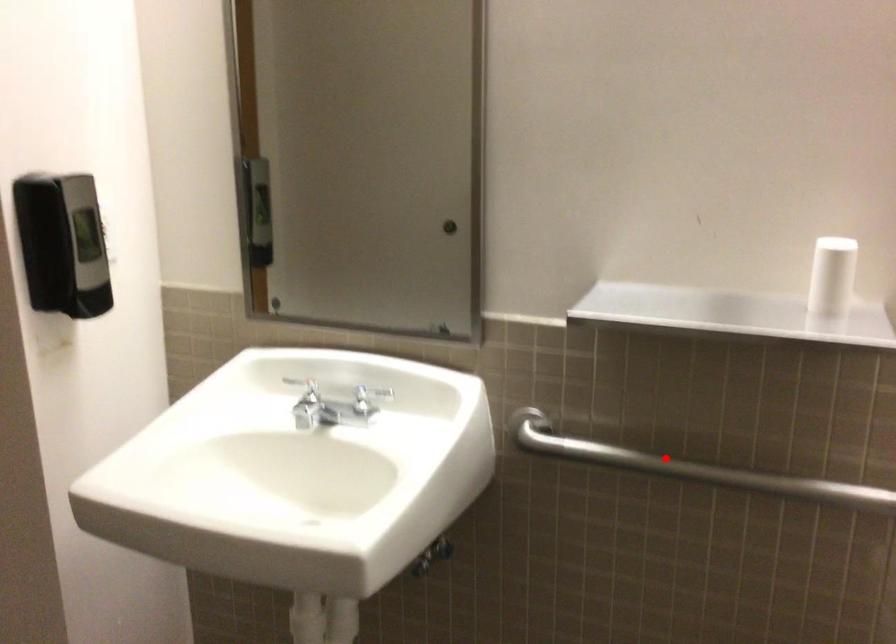
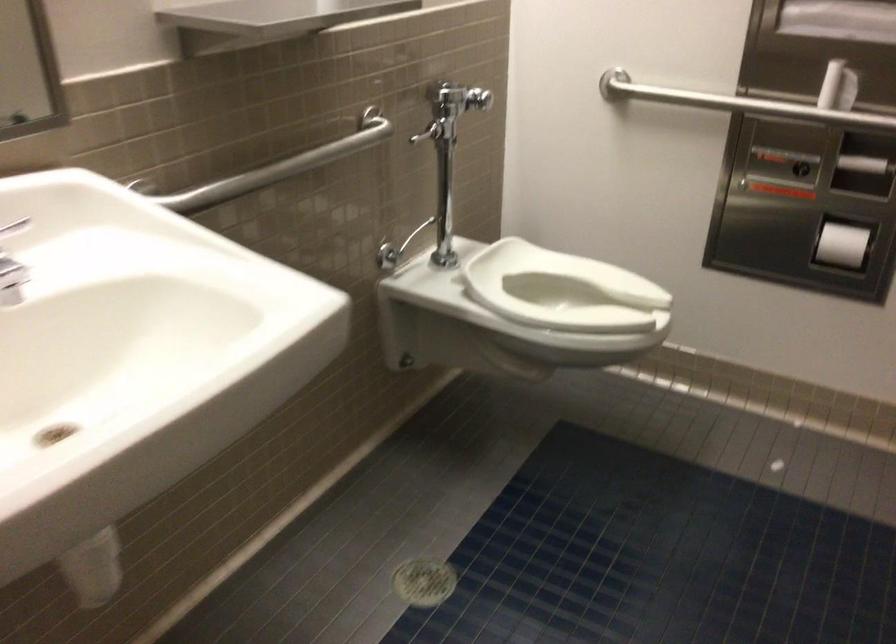
Question: A red point is marked in image1. In image2, is the corresponding 3D point closer to the camera or farther? Reply with the corresponding letter.

Choices:
 (A) The corresponding 3D point is closer.
 (B) The corresponding 3D point is farther.

Answer: (B)